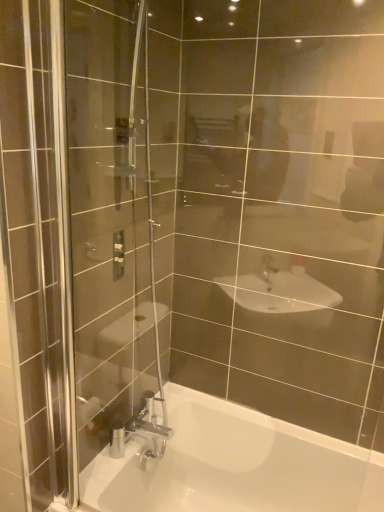
Question: From the image's perspective, is matte silver shower controls at upper left positioned above or below white glossy bathtub at lower center?

Choices:
 (A) below
 (B) above

Answer: (B)

Question: In terms of width, does matte silver shower controls at upper left look wider or thinner when compared to white glossy bathtub at lower center?

Choices:
 (A) thin
 (B) wide

Answer: (A)

Question: Would you say matte silver shower controls at upper left is to the left or to the right of white glossy bathtub at lower center in the picture?

Choices:
 (A) left
 (B) right

Answer: (A)

Question: From the image's perspective, is white glossy bathtub at lower center located above or below matte silver shower controls at upper left?

Choices:
 (A) below
 (B) above

Answer: (A)

Question: In the image, is white glossy bathtub at lower center on the left side or the right side of matte silver shower controls at upper left?

Choices:
 (A) left
 (B) right

Answer: (B)

Question: Would you say white glossy bathtub at lower center is inside or outside matte silver shower controls at upper left?

Choices:
 (A) inside
 (B) outside

Answer: (B)

Question: From a real-world perspective, is white glossy bathtub at lower center above or below matte silver shower controls at upper left?

Choices:
 (A) below
 (B) above

Answer: (A)